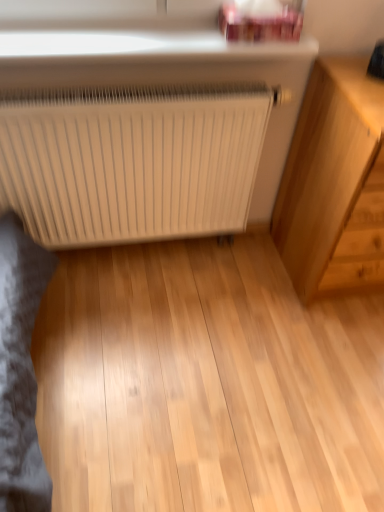
Question: Would you say light wood chest of drawers at right is inside or outside white matte radiator at center?

Choices:
 (A) outside
 (B) inside

Answer: (A)

Question: In the image, is light wood chest of drawers at right on the left side or the right side of white matte radiator at center?

Choices:
 (A) left
 (B) right

Answer: (B)

Question: Is light wood chest of drawers at right in front of or behind white matte radiator at center in the image?

Choices:
 (A) behind
 (B) front

Answer: (B)

Question: Is point (193, 200) closer or farther from the camera than point (382, 83)?

Choices:
 (A) farther
 (B) closer

Answer: (A)

Question: Considering the positions of white matte radiator at center and light wood chest of drawers at right in the image, is white matte radiator at center wider or thinner than light wood chest of drawers at right?

Choices:
 (A) thin
 (B) wide

Answer: (A)

Question: In terms of size, does white matte radiator at center appear bigger or smaller than light wood chest of drawers at right?

Choices:
 (A) big
 (B) small

Answer: (B)

Question: From their relative heights in the image, would you say white matte radiator at center is taller or shorter than light wood chest of drawers at right?

Choices:
 (A) short
 (B) tall

Answer: (A)